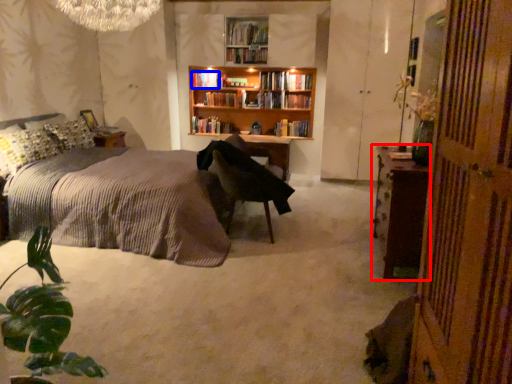
Question: Which point is further to the camera, nightstand (highlighted by a red box) or book (highlighted by a blue box)?

Choices:
 (A) nightstand
 (B) book

Answer: (B)